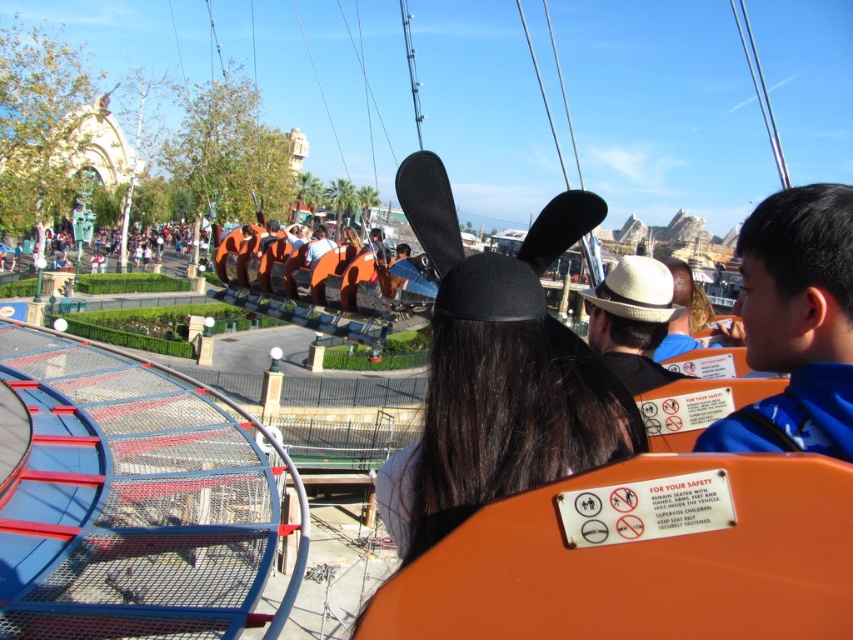
You are a photographer standing near the roller coaster. You want to take a photo of the orange fabric shirt at center and the black fabric hat at center. Which object should you focus on first to ensure both are in the frame?

The black fabric hat at center is positioned under the orange fabric shirt at center, so you should focus on the orange fabric shirt at center first to ensure both are in the frame.

You are a park safety inspector checking the distance between the black fabric hat at center and the orange fabric shirt at center on the roller coaster. According to safety regulations, the minimum distance between any two passengers should be at least 30 meters to prevent collisions during sudden movements. Is the current distance compliant with the safety standards?

The black fabric hat at center and orange fabric shirt at center are 29.08 meters apart, which is less than the required 30 meters. Therefore, the current distance does not comply with the safety standards and needs adjustment.

You are a photographer standing in the theme park and want to take a photo of the orange fabric crowd at center and the black fabric hat at center. Which object should you focus on first if you want to capture both in the same frame without moving the camera?

The black fabric hat at center is to the right of orange fabric crowd at center, so you should focus on the orange fabric crowd at center first since it is closer to the left side, allowing both to be captured in the frame without moving the camera.